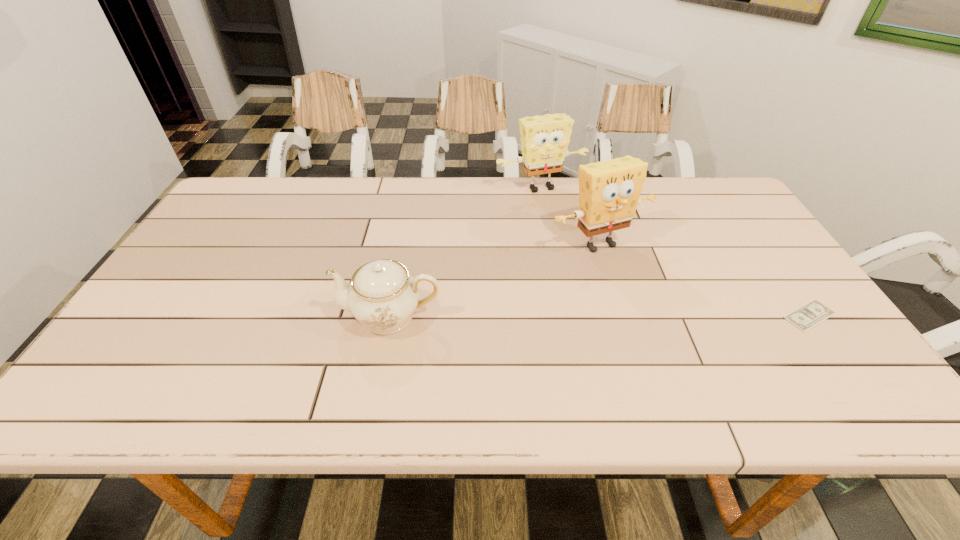
Locate an element on the screen. The width and height of the screenshot is (960, 540). free space located on the face of the farthest object is located at coordinates (604, 271).

Image resolution: width=960 pixels, height=540 pixels. I want to click on free space located 0.210m on the face of the farthest object, so click(x=581, y=237).

The width and height of the screenshot is (960, 540). In order to click on vacant space located 0.130m on the face of the farthest object in this screenshot , I will do `click(569, 220)`.

Locate an element on the screen. The image size is (960, 540). free region located on the face of the second farthest object is located at coordinates (673, 315).

Image resolution: width=960 pixels, height=540 pixels. I want to click on free space located on the face of the second farthest object, so 636,275.

The height and width of the screenshot is (540, 960). I want to click on free region located 0.350m on the face of the second farthest object, so click(711, 357).

Identify the location of object located at the far edge. (544, 139).

At what (x,y) coordinates should I click in order to perform the action: click on object that is at the near edge. Please return your answer as a coordinate pair (x, y). Looking at the image, I should click on (383, 295).

At what (x,y) coordinates should I click in order to perform the action: click on object that is at the right edge. Please return your answer as a coordinate pair (x, y). Looking at the image, I should click on (807, 316).

Identify the location of free space at the far edge of the desktop. This screenshot has width=960, height=540. coord(386,203).